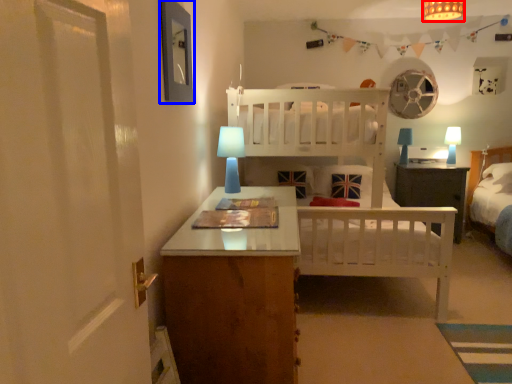
Question: Which object appears closest to the camera in this image, light fixture (highlighted by a red box) or picture frame (highlighted by a blue box)?

Choices:
 (A) light fixture
 (B) picture frame

Answer: (B)